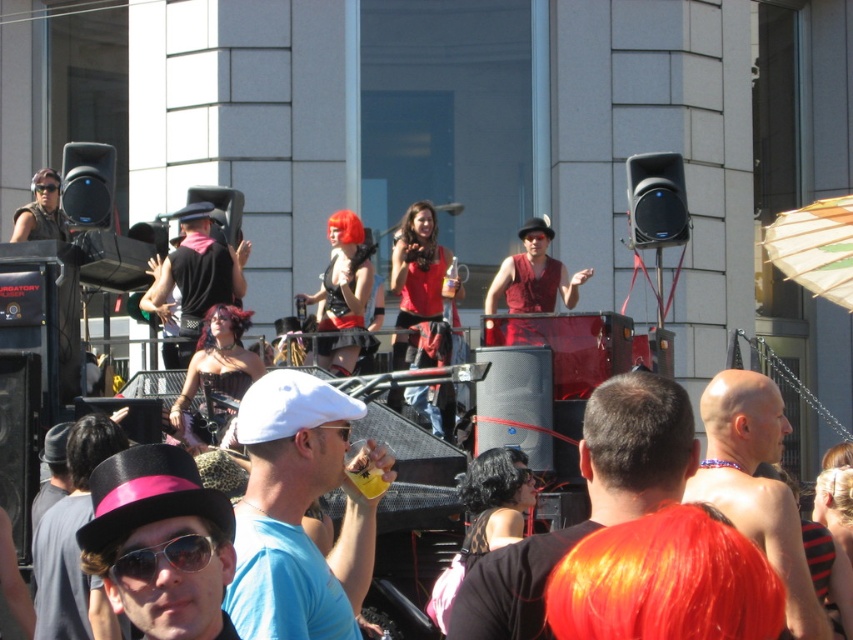
You are standing in the crowd at the music event and want to move from your current position to the stage. You notice two points marked in the image. One is at point (556,540) and the other at point (122,556). Which point should you move towards to get closer to the stage?

You should move towards point (122,556) because it is closer to the stage than point (556,540), which is further away from the stage.

You are standing at the center of the image and want to find the shiny black hat at center. According to the coordinates provided, in which direction should you look to locate it?

The shiny black hat at center is located at coordinates point (x=589, y=500). Since you are at the center, you should look to the upper right direction to find it.